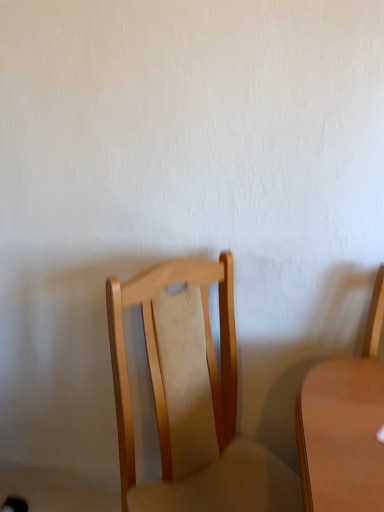
You are a GUI agent. You are given a task and a screenshot of the screen. Output one action in this format:
    pyautogui.click(x=<x>, y=<y>)
    Task: Click on the light brown wood chair at right, acting as the 1th chair starting from the right
    Image resolution: width=384 pixels, height=512 pixels.
    Given the screenshot: What is the action you would take?
    pyautogui.click(x=344, y=425)

The width and height of the screenshot is (384, 512). Describe the element at coordinates (344, 425) in the screenshot. I see `light brown wood chair at right, acting as the 1th chair starting from the right` at that location.

What do you see at coordinates (204, 410) in the screenshot? This screenshot has width=384, height=512. I see `light wood chair at center, the 1th chair when ordered from left to right` at bounding box center [204, 410].

Locate an element on the screen. The height and width of the screenshot is (512, 384). light wood chair at center, placed as the second chair when sorted from right to left is located at coordinates (204, 410).

Measure the distance between point (x=176, y=490) and camera.

Point (x=176, y=490) and camera are 3.34 feet apart from each other.

Locate an element on the screen. light brown wood chair at right, acting as the 1th chair starting from the right is located at coordinates (344, 425).

Which is more to the right, light wood chair at center, placed as the second chair when sorted from right to left, or light brown wood chair at right, acting as the 1th chair starting from the right?

light brown wood chair at right, acting as the 1th chair starting from the right.

Is light wood chair at center, placed as the second chair when sorted from right to left, positioned behind light brown wood chair at right, placed as the second chair when sorted from left to right?

No, light wood chair at center, placed as the second chair when sorted from right to left, is closer to the camera.

Is point (132, 290) positioned behind point (345, 362)?

No.

From the image's perspective, between light wood chair at center, the 1th chair when ordered from left to right, and light brown wood chair at right, acting as the 1th chair starting from the right, which one is located above?

From the image's view, light brown wood chair at right, acting as the 1th chair starting from the right, is above.

From a real-world perspective, between light wood chair at center, the 1th chair when ordered from left to right, and light brown wood chair at right, acting as the 1th chair starting from the right, who is vertically higher?

light brown wood chair at right, acting as the 1th chair starting from the right, from a real-world perspective.

Considering the sizes of light wood chair at center, the 1th chair when ordered from left to right, and light brown wood chair at right, placed as the second chair when sorted from left to right, in the image, is light wood chair at center, the 1th chair when ordered from left to right, wider or thinner than light brown wood chair at right, placed as the second chair when sorted from left to right,?

Considering their sizes, light wood chair at center, the 1th chair when ordered from left to right, looks broader than light brown wood chair at right, placed as the second chair when sorted from left to right.

Looking at this image, considering the sizes of objects light wood chair at center, placed as the second chair when sorted from right to left, and light brown wood chair at right, placed as the second chair when sorted from left to right, in the image provided, who is shorter, light wood chair at center, placed as the second chair when sorted from right to left, or light brown wood chair at right, placed as the second chair when sorted from left to right,?

With less height is light brown wood chair at right, placed as the second chair when sorted from left to right.

Considering the relative sizes of light wood chair at center, placed as the second chair when sorted from right to left, and light brown wood chair at right, placed as the second chair when sorted from left to right, in the image provided, is light wood chair at center, placed as the second chair when sorted from right to left, smaller than light brown wood chair at right, placed as the second chair when sorted from left to right,?

Actually, light wood chair at center, placed as the second chair when sorted from right to left, might be larger than light brown wood chair at right, placed as the second chair when sorted from left to right.

Would you say light wood chair at center, the 1th chair when ordered from left to right, is outside light brown wood chair at right, placed as the second chair when sorted from left to right?

That's correct, light wood chair at center, the 1th chair when ordered from left to right, is outside of light brown wood chair at right, placed as the second chair when sorted from left to right.

Are light wood chair at center, the 1th chair when ordered from left to right, and light brown wood chair at right, placed as the second chair when sorted from left to right, far apart?

No, light wood chair at center, the 1th chair when ordered from left to right, is not far away from light brown wood chair at right, placed as the second chair when sorted from left to right.

Is light wood chair at center, the 1th chair when ordered from left to right, aimed at light brown wood chair at right, placed as the second chair when sorted from left to right?

No, light wood chair at center, the 1th chair when ordered from left to right, is not turned towards light brown wood chair at right, placed as the second chair when sorted from left to right.

Measure the distance from light wood chair at center, the 1th chair when ordered from left to right, to light brown wood chair at right, acting as the 1th chair starting from the right.

light wood chair at center, the 1th chair when ordered from left to right, and light brown wood chair at right, acting as the 1th chair starting from the right, are 12.89 inches apart from each other.

Find the location of a particular element. Image resolution: width=384 pixels, height=512 pixels. chair in front of the light brown wood chair at right, placed as the second chair when sorted from left to right is located at coordinates (204, 410).

Considering the positions of objects light brown wood chair at right, acting as the 1th chair starting from the right, and light wood chair at center, the 1th chair when ordered from left to right, in the image provided, who is more to the left, light brown wood chair at right, acting as the 1th chair starting from the right, or light wood chair at center, the 1th chair when ordered from left to right,?

light wood chair at center, the 1th chair when ordered from left to right, is more to the left.

Which is in front, light brown wood chair at right, placed as the second chair when sorted from left to right, or light wood chair at center, the 1th chair when ordered from left to right?

Positioned in front is light wood chair at center, the 1th chair when ordered from left to right.

Which is behind, point (338, 496) or point (216, 263)?

The point (216, 263) is farther from the camera.

From the image's perspective, which one is positioned lower, light brown wood chair at right, placed as the second chair when sorted from left to right, or light wood chair at center, placed as the second chair when sorted from right to left?

light wood chair at center, placed as the second chair when sorted from right to left.

From a real-world perspective, between light brown wood chair at right, placed as the second chair when sorted from left to right, and light wood chair at center, placed as the second chair when sorted from right to left, who is vertically higher?

In real-world perspective, light brown wood chair at right, placed as the second chair when sorted from left to right, is above.

Is light brown wood chair at right, placed as the second chair when sorted from left to right, wider or thinner than light wood chair at center, placed as the second chair when sorted from right to left?

In the image, light brown wood chair at right, placed as the second chair when sorted from left to right, appears to be more narrow than light wood chair at center, placed as the second chair when sorted from right to left.

Considering the relative sizes of light brown wood chair at right, acting as the 1th chair starting from the right, and light wood chair at center, placed as the second chair when sorted from right to left, in the image provided, is light brown wood chair at right, acting as the 1th chair starting from the right, shorter than light wood chair at center, placed as the second chair when sorted from right to left,?

Yes, light brown wood chair at right, acting as the 1th chair starting from the right, is shorter than light wood chair at center, placed as the second chair when sorted from right to left.

Considering the sizes of objects light brown wood chair at right, placed as the second chair when sorted from left to right, and light wood chair at center, the 1th chair when ordered from left to right, in the image provided, who is bigger, light brown wood chair at right, placed as the second chair when sorted from left to right, or light wood chair at center, the 1th chair when ordered from left to right,?

Bigger between the two is light wood chair at center, the 1th chair when ordered from left to right.

Can we say light brown wood chair at right, placed as the second chair when sorted from left to right, lies outside light wood chair at center, the 1th chair when ordered from left to right?

light brown wood chair at right, placed as the second chair when sorted from left to right, is positioned outside light wood chair at center, the 1th chair when ordered from left to right.

Is light brown wood chair at right, placed as the second chair when sorted from left to right, not close to light wood chair at center, placed as the second chair when sorted from right to left?

light brown wood chair at right, placed as the second chair when sorted from left to right, is actually quite close to light wood chair at center, placed as the second chair when sorted from right to left.

Could you tell me if light brown wood chair at right, placed as the second chair when sorted from left to right, is facing light wood chair at center, placed as the second chair when sorted from right to left?

No, light brown wood chair at right, placed as the second chair when sorted from left to right, is not oriented towards light wood chair at center, placed as the second chair when sorted from right to left.

How many degrees apart are the facing directions of light brown wood chair at right, acting as the 1th chair starting from the right, and light wood chair at center, the 1th chair when ordered from left to right?

They differ by 39.6 degrees in their facing directions.

Where is `chair in front of the light brown wood chair at right, acting as the 1th chair starting from the right`? This screenshot has height=512, width=384. chair in front of the light brown wood chair at right, acting as the 1th chair starting from the right is located at coordinates (204, 410).

What are the coordinates of `chair behind the light wood chair at center, placed as the second chair when sorted from right to left` in the screenshot? It's located at (344, 425).

Where is `chair that is under the light brown wood chair at right, placed as the second chair when sorted from left to right (from a real-world perspective)`? This screenshot has width=384, height=512. chair that is under the light brown wood chair at right, placed as the second chair when sorted from left to right (from a real-world perspective) is located at coordinates (204, 410).